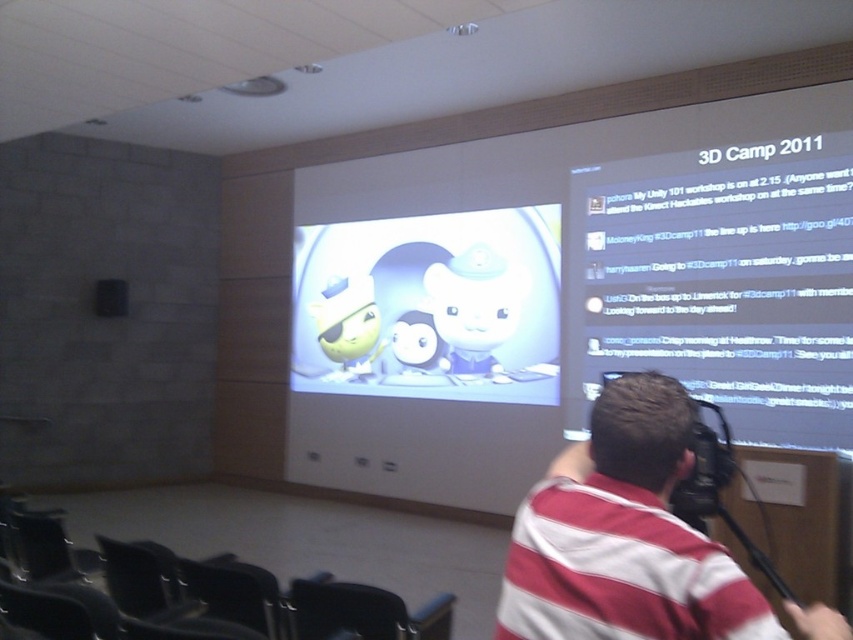
Question: Is striped cotton shirt at center smaller than black plastic video camera at upper right?

Choices:
 (A) no
 (B) yes

Answer: (B)

Question: Which of these objects is positioned closest to the white matte text at upper center?

Choices:
 (A) striped cotton shirt at center
 (B) matte cartoon characters at center

Answer: (B)

Question: Which of these objects is positioned farthest from the striped cotton shirt at center?

Choices:
 (A) black plastic chair at lower left
 (B) white matte text at upper center
 (C) matte cartoon characters at center
 (D) black plastic video camera at upper right

Answer: (C)

Question: Is matte cartoon characters at center below black plastic video camera at upper right?

Choices:
 (A) yes
 (B) no

Answer: (B)

Question: Which point is farther to the camera?

Choices:
 (A) matte cartoon characters at center
 (B) black plastic video camera at upper right
 (C) white matte text at upper center
 (D) black plastic chair at lower left

Answer: (A)

Question: Does striped cotton shirt at center appear on the left side of black plastic video camera at upper right?

Choices:
 (A) yes
 (B) no

Answer: (A)